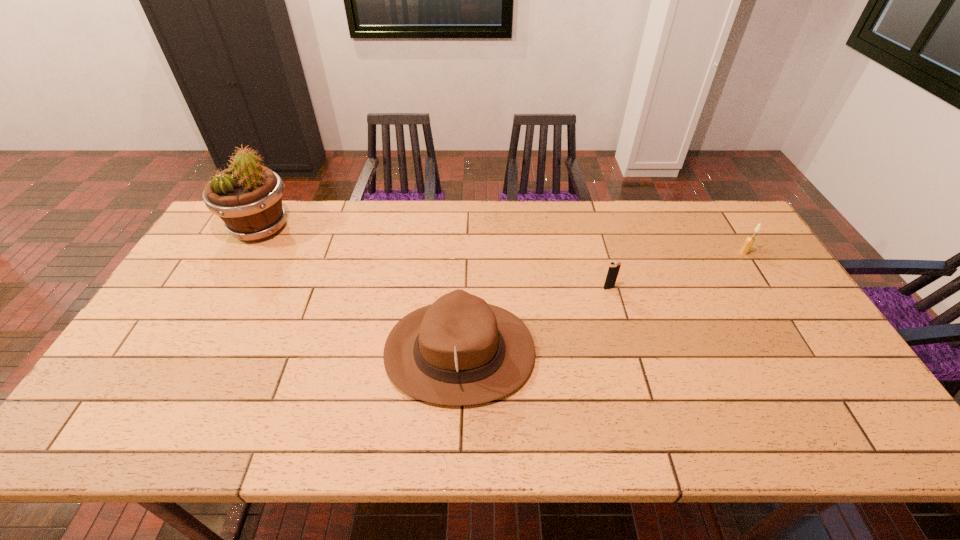
Where is `free region located on the left of the igniter`? This screenshot has height=540, width=960. free region located on the left of the igniter is located at coordinates (485, 288).

Identify the location of object that is at the far edge. Image resolution: width=960 pixels, height=540 pixels. (247, 196).

The height and width of the screenshot is (540, 960). I want to click on object that is at the near edge, so click(x=459, y=350).

You are a GUI agent. You are given a task and a screenshot of the screen. Output one action in this format:
    pyautogui.click(x=<x>, y=<y>)
    Task: Click on the object at the left edge
    The image size is (960, 540).
    Given the screenshot: What is the action you would take?
    pyautogui.click(x=247, y=196)

Image resolution: width=960 pixels, height=540 pixels. I want to click on object present at the right edge, so click(x=749, y=241).

The width and height of the screenshot is (960, 540). In order to click on object that is at the far left corner in this screenshot , I will do `click(247, 196)`.

The height and width of the screenshot is (540, 960). Find the location of `free space at the far edge of the desktop`. free space at the far edge of the desktop is located at coordinates (440, 234).

I want to click on vacant space at the near edge of the desktop, so click(624, 424).

You are a GUI agent. You are given a task and a screenshot of the screen. Output one action in this format:
    pyautogui.click(x=<x>, y=<y>)
    Task: Click on the vacant space at the left edge of the desktop
    The width and height of the screenshot is (960, 540).
    Given the screenshot: What is the action you would take?
    pyautogui.click(x=204, y=325)

The image size is (960, 540). Identify the location of vacant area at the right edge. (768, 328).